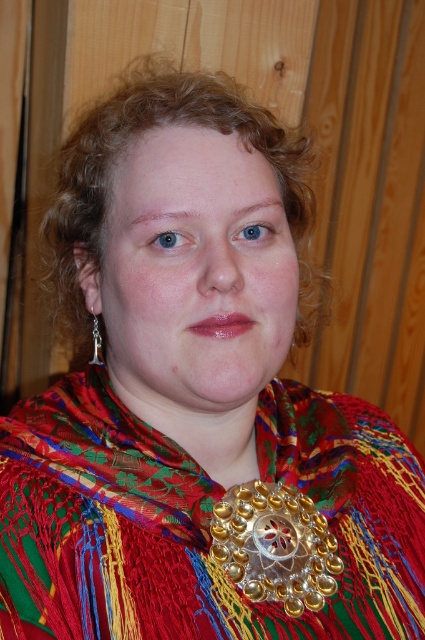
Is multicolored woven scarf at center bigger than curly blonde hair at center?

Actually, multicolored woven scarf at center might be smaller than curly blonde hair at center.

Who is higher up, multicolored woven scarf at center or curly blonde hair at center?

curly blonde hair at center is above.

What do you see at coordinates (198, 520) in the screenshot? This screenshot has width=425, height=640. I see `multicolored woven scarf at center` at bounding box center [198, 520].

At what (x,y) coordinates should I click in order to perform the action: click on multicolored woven scarf at center. Please return your answer as a coordinate pair (x, y). Looking at the image, I should click on (198, 520).

Find the location of a particular element. curly blonde hair at center is located at coordinates (163, 128).

Is curly blonde hair at center shorter than gold metallic necklace at center?

No.

Where is `curly blonde hair at center`? curly blonde hair at center is located at coordinates (163, 128).

Where is `curly blonde hair at center`? curly blonde hair at center is located at coordinates (163, 128).

Does multicolored woven scarf at center have a lesser height compared to gold metallic necklace at center?

In fact, multicolored woven scarf at center may be taller than gold metallic necklace at center.

Is multicolored woven scarf at center to the left of gold metallic necklace at center from the viewer's perspective?

Indeed, multicolored woven scarf at center is positioned on the left side of gold metallic necklace at center.

You are a GUI agent. You are given a task and a screenshot of the screen. Output one action in this format:
    pyautogui.click(x=<x>, y=<y>)
    Task: Click on the multicolored woven scarf at center
    This screenshot has width=425, height=640.
    Given the screenshot: What is the action you would take?
    pyautogui.click(x=198, y=520)

You are a GUI agent. You are given a task and a screenshot of the screen. Output one action in this format:
    pyautogui.click(x=<x>, y=<y>)
    Task: Click on the multicolored woven scarf at center
    The width and height of the screenshot is (425, 640).
    Given the screenshot: What is the action you would take?
    pyautogui.click(x=198, y=520)